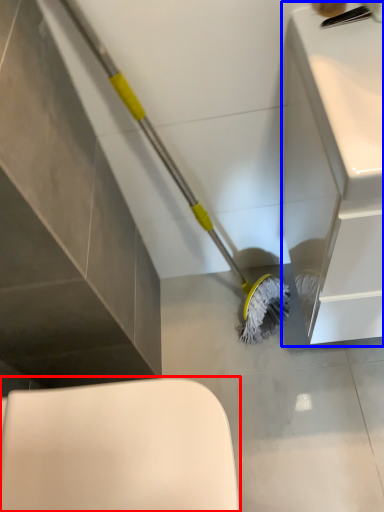
Question: Which object appears farthest to the camera in this image, toilet (highlighted by a red box) or counter top (highlighted by a blue box)?

Choices:
 (A) toilet
 (B) counter top

Answer: (A)